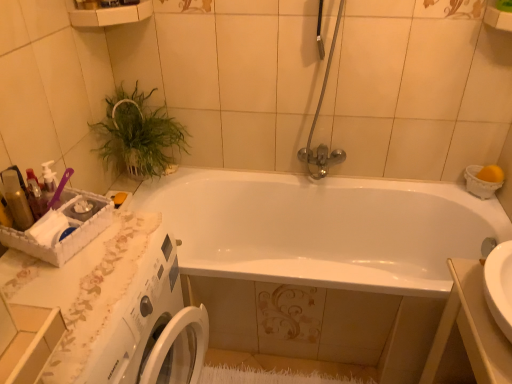
The width and height of the screenshot is (512, 384). What do you see at coordinates (323, 228) in the screenshot? I see `white glossy bathtub at center` at bounding box center [323, 228].

What do you see at coordinates (137, 135) in the screenshot?
I see `green leafy plant at upper left` at bounding box center [137, 135].

The image size is (512, 384). Describe the element at coordinates (16, 199) in the screenshot. I see `shiny plastic bottles at left` at that location.

Measure the distance between point (12, 207) and camera.

Point (12, 207) and camera are 3.60 feet apart from each other.

The image size is (512, 384). I want to click on white glossy bathtub at center, so click(323, 228).

Which is closer, (6, 187) or (492, 373)?

Point (6, 187) is farther from the camera than point (492, 373).

Is shiny plastic bottles at left facing towards white glossy sink at lower right?

No, shiny plastic bottles at left is not aimed at white glossy sink at lower right.

From their relative heights in the image, would you say shiny plastic bottles at left is taller or shorter than white glossy sink at lower right?

Considering their sizes, shiny plastic bottles at left has less height than white glossy sink at lower right.

Considering the sizes of objects shiny plastic bottles at left and white glossy sink at lower right in the image provided, who is smaller, shiny plastic bottles at left or white glossy sink at lower right?

With smaller size is shiny plastic bottles at left.

Considering the positions of points (494, 253) and (18, 223), is point (494, 253) closer to camera compared to point (18, 223)?

No, it is behind (18, 223).

Visually, is white glossy sink at lower right positioned to the left or to the right of shiny plastic bottles at left?

white glossy sink at lower right is positioned on shiny plastic bottles at left's right side.

In the scene shown: From a real-world perspective, which object rests below the other?

From a 3D spatial view, white glossy sink at lower right is below.

From the image's perspective, is white glossy sink at lower right located above shiny plastic bottles at left?

Incorrect, from the image's perspective, white glossy sink at lower right is lower than shiny plastic bottles at left.

In the scene shown: Considering the positions of objects shiny plastic bottles at left and chrome metallic shower door at upper center in the image provided, who is behind, shiny plastic bottles at left or chrome metallic shower door at upper center?

Positioned behind is chrome metallic shower door at upper center.

Locate an element on the screen. shower door positioned vertically above the shiny plastic bottles at left (from a real-world perspective) is located at coordinates (316, 122).

From the picture: Considering the positions of objects shiny plastic bottles at left and chrome metallic shower door at upper center in the image provided, who is more to the right, shiny plastic bottles at left or chrome metallic shower door at upper center?

chrome metallic shower door at upper center is more to the right.

Find the location of `plant above the white glossy sink at lower right (from the image's perspective)`. plant above the white glossy sink at lower right (from the image's perspective) is located at coordinates point(137,135).

Which is behind, white glossy sink at lower right or green leafy plant at upper left?

green leafy plant at upper left is more distant.

Which of these two, white glossy sink at lower right or green leafy plant at upper left, stands taller?

white glossy sink at lower right.

Looking at this image, what's the angular difference between white glossy sink at lower right and green leafy plant at upper left's facing directions?

They differ by 176 degrees in their facing directions.

Identify the location of toiletry positioned vertically above the green leafy plant at upper left (from a real-world perspective). Image resolution: width=512 pixels, height=384 pixels. (16, 199).

Is point (21, 206) behind point (110, 112)?

No, (21, 206) is in front of (110, 112).

Considering the relative sizes of shiny plastic bottles at left and green leafy plant at upper left in the image provided, is shiny plastic bottles at left bigger than green leafy plant at upper left?

No, shiny plastic bottles at left is not bigger than green leafy plant at upper left.

Considering the positions of objects shiny plastic bottles at left and green leafy plant at upper left in the image provided, who is in front, shiny plastic bottles at left or green leafy plant at upper left?

shiny plastic bottles at left is closer to the camera.

Considering the relative sizes of green leafy plant at upper left and white lace counter top at lower left in the image provided, is green leafy plant at upper left shorter than white lace counter top at lower left?

Correct, green leafy plant at upper left is not as tall as white lace counter top at lower left.

Considering the relative sizes of green leafy plant at upper left and white lace counter top at lower left in the image provided, is green leafy plant at upper left thinner than white lace counter top at lower left?

Yes.

How different are the orientations of green leafy plant at upper left and white lace counter top at lower left in degrees?

The angle between the facing direction of green leafy plant at upper left and the facing direction of white lace counter top at lower left is 0.879 degrees.

Considering the points (161, 163) and (105, 267), which point is behind, point (161, 163) or point (105, 267)?

The point (161, 163) is farther from the camera.

How much distance is there between chrome metallic shower door at upper center and green leafy plant at upper left?

The distance of chrome metallic shower door at upper center from green leafy plant at upper left is 28.91 inches.

From a real-world perspective, is chrome metallic shower door at upper center positioned above or below green leafy plant at upper left?

From a real-world perspective, chrome metallic shower door at upper center is physically above green leafy plant at upper left.

From the image's perspective, is chrome metallic shower door at upper center on top of green leafy plant at upper left?

Yes, from the image's perspective, chrome metallic shower door at upper center is over green leafy plant at upper left.

Which of these two, chrome metallic shower door at upper center or green leafy plant at upper left, stands taller?

chrome metallic shower door at upper center.

Locate an element on the screen. This screenshot has width=512, height=384. sink in front of the shiny plastic bottles at left is located at coordinates (479, 317).

The width and height of the screenshot is (512, 384). Find the location of `sink that appears on the right of shiny plastic bottles at left`. sink that appears on the right of shiny plastic bottles at left is located at coordinates (479, 317).

When comparing their distances from white glossy sink at lower right, does green leafy plant at upper left or white glossy bathtub at center seem closer?

white glossy bathtub at center is positioned closer to the anchor white glossy sink at lower right.

Which object lies nearer to the anchor point green leafy plant at upper left, white glossy bathtub at center or white glossy sink at lower right?

white glossy bathtub at center lies closer to green leafy plant at upper left than the other object.

Consider the image. Estimate the real-world distances between objects in this image. Which object is closer to shiny plastic bottles at left, green leafy plant at upper left or white glossy sink at lower right?

green leafy plant at upper left is closer to shiny plastic bottles at left.

Estimate the real-world distances between objects in this image. Which object is closer to chrome metallic shower door at upper center, shiny plastic bottles at left or green leafy plant at upper left?

green leafy plant at upper left lies closer to chrome metallic shower door at upper center than the other object.

When comparing their distances from shiny plastic bottles at left, does green leafy plant at upper left or chrome metallic shower door at upper center seem further?

chrome metallic shower door at upper center is positioned further to the anchor shiny plastic bottles at left.

When comparing their distances from white glossy bathtub at center, does white lace counter top at lower left or green leafy plant at upper left seem closer?

Based on the image, green leafy plant at upper left appears to be nearer to white glossy bathtub at center.

From the image, which object appears to be nearer to white glossy sink at lower right, green leafy plant at upper left or white lace counter top at lower left?

The object closer to white glossy sink at lower right is white lace counter top at lower left.

When comparing their distances from white glossy sink at lower right, does white glossy bathtub at center or white lace counter top at lower left seem further?

Among the two, white lace counter top at lower left is located further to white glossy sink at lower right.

The image size is (512, 384). In order to click on bathtub between green leafy plant at upper left and white glossy sink at lower right from left to right in this screenshot , I will do `click(323, 228)`.

The image size is (512, 384). Find the location of `plant that lies between chrome metallic shower door at upper center and white lace counter top at lower left from top to bottom`. plant that lies between chrome metallic shower door at upper center and white lace counter top at lower left from top to bottom is located at coordinates (137, 135).

Locate an element on the screen. This screenshot has height=384, width=512. bathtub between chrome metallic shower door at upper center and white glossy sink at lower right from top to bottom is located at coordinates (323, 228).

Locate an element on the screen. Image resolution: width=512 pixels, height=384 pixels. plant between shiny plastic bottles at left and chrome metallic shower door at upper center is located at coordinates (137, 135).